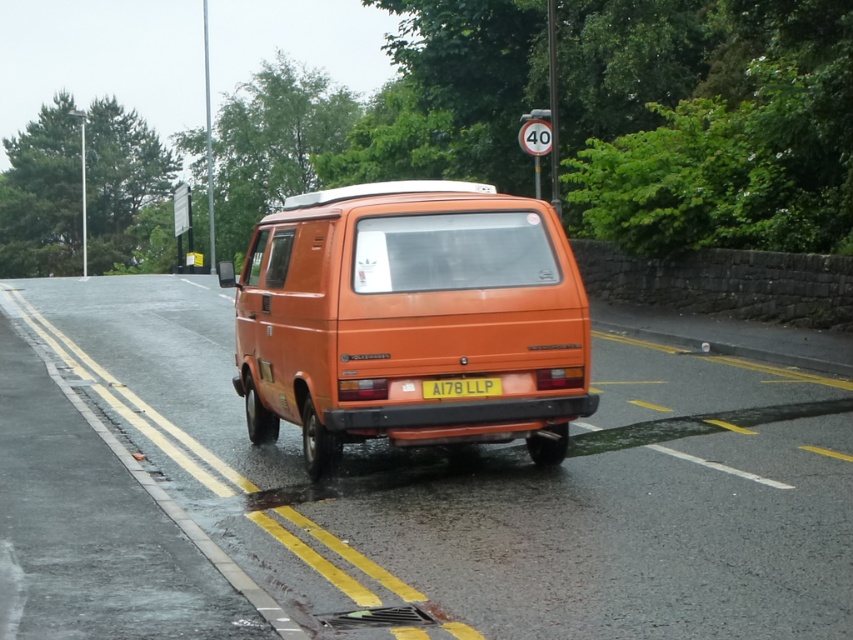
Question: Which of the following is the farthest from the observer?

Choices:
 (A) orange matte van at center
 (B) yellow matte license plate at center

Answer: (A)

Question: Which point is farther to the camera?

Choices:
 (A) (387, 353)
 (B) (492, 381)

Answer: (B)

Question: Can you confirm if orange matte van at center is positioned above yellow matte license plate at center?

Choices:
 (A) no
 (B) yes

Answer: (B)

Question: Is orange matte van at center bigger than yellow matte license plate at center?

Choices:
 (A) yes
 (B) no

Answer: (A)

Question: Is orange matte van at center in front of yellow matte license plate at center?

Choices:
 (A) no
 (B) yes

Answer: (A)